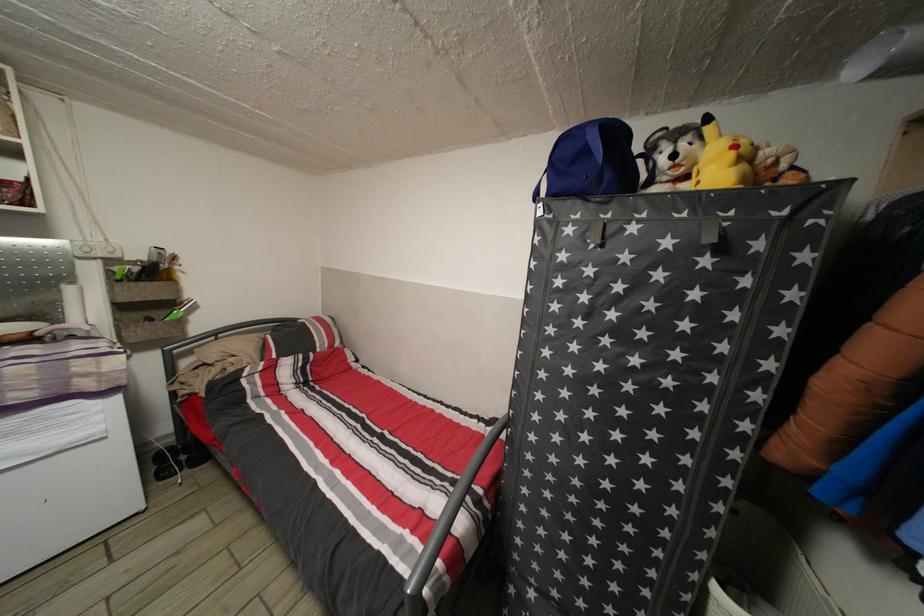
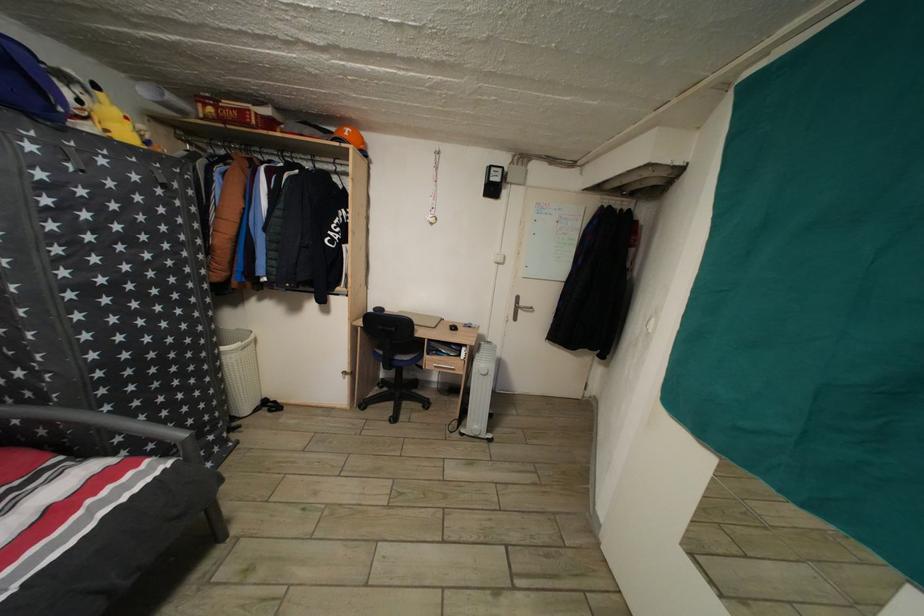
Find the pixel in the second image that matches pixel 414 539 in the first image.

(96, 508)